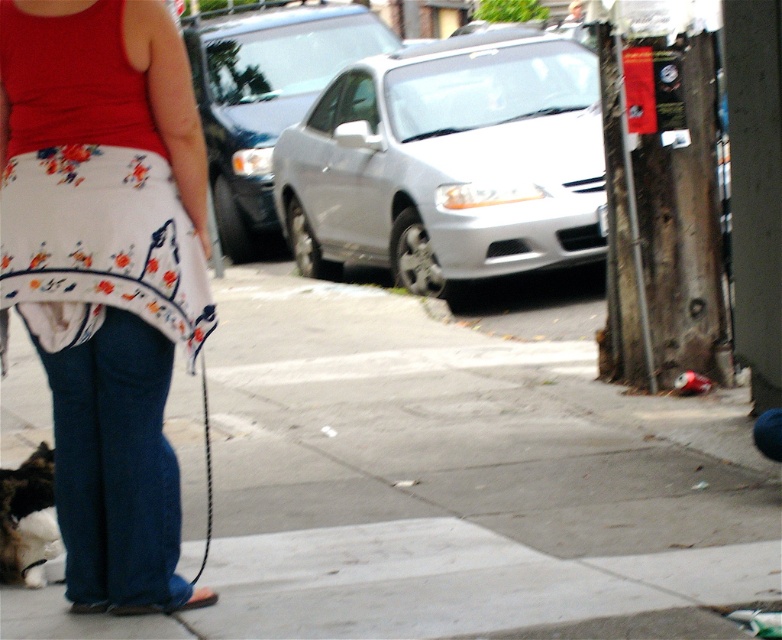
Question: Based on their relative distances, which object is farther from the floral-patterned apron at center?

Choices:
 (A) fluffy fur cat at lower left
 (B) gray concrete sidewalk at center

Answer: (B)

Question: Does gray concrete sidewalk at center have a greater width compared to black rope leash at lower left?

Choices:
 (A) yes
 (B) no

Answer: (A)

Question: Is floral-patterned apron at center thinner than black rope leash at lower left?

Choices:
 (A) yes
 (B) no

Answer: (B)

Question: Among these points, which one is farthest from the camera?

Choices:
 (A) (13, 582)
 (B) (207, 468)
 (C) (307, 433)

Answer: (C)

Question: Estimate the real-world distances between objects in this image. Which object is farther from the black rope leash at lower left?

Choices:
 (A) gray concrete sidewalk at center
 (B) fluffy fur cat at lower left
 (C) floral-patterned apron at center

Answer: (A)

Question: Can you confirm if gray concrete sidewalk at center is thinner than black rope leash at lower left?

Choices:
 (A) no
 (B) yes

Answer: (A)